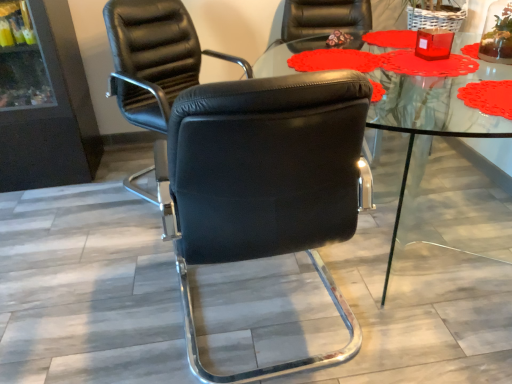
The image size is (512, 384). Find the location of `vacant area that is in front of black leather chair at center, which ranks as the 2th chair in front-to-back order`. vacant area that is in front of black leather chair at center, which ranks as the 2th chair in front-to-back order is located at coordinates (121, 258).